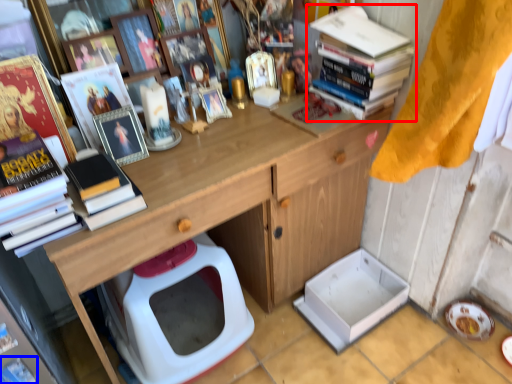
Question: Among these objects, which one is farthest to the camera, book (highlighted by a red box) or magazine (highlighted by a blue box)?

Choices:
 (A) book
 (B) magazine

Answer: (A)